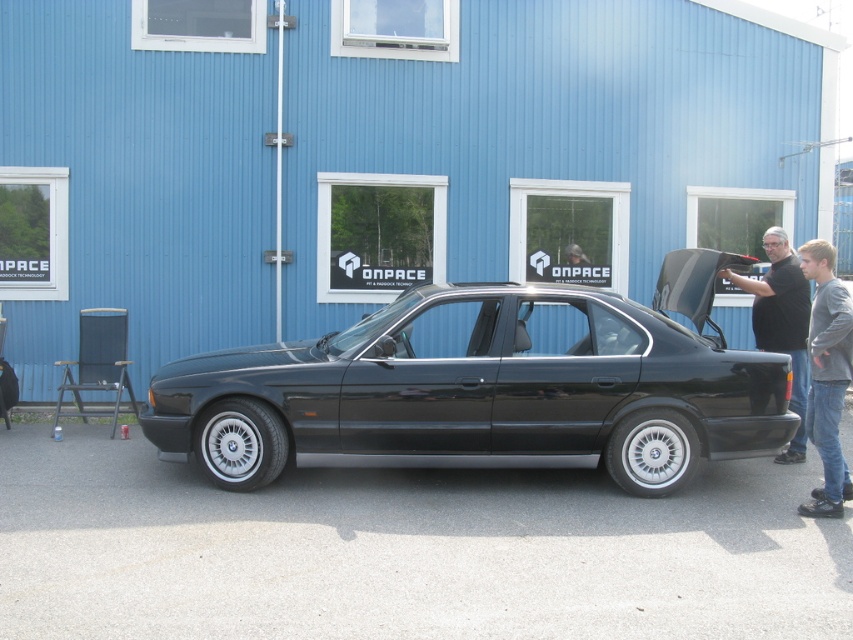
Question: Which object is farther from the camera taking this photo?

Choices:
 (A) black metallic car at center
 (B) gray cotton sweater at lower right

Answer: (A)

Question: Is the position of black metallic car at center more distant than that of black matte shirt at right?

Choices:
 (A) yes
 (B) no

Answer: (B)

Question: Does black metallic car at center have a lesser width compared to black matte shirt at right?

Choices:
 (A) no
 (B) yes

Answer: (A)

Question: Among these objects, which one is nearest to the camera?

Choices:
 (A) black matte shirt at right
 (B) black metallic car at center

Answer: (B)

Question: Can you confirm if gray cotton sweater at lower right is positioned above black matte shirt at right?

Choices:
 (A) no
 (B) yes

Answer: (A)

Question: Among these points, which one is farthest from the camera?

Choices:
 (A) (811, 348)
 (B) (534, 356)
 (C) (805, 342)

Answer: (C)